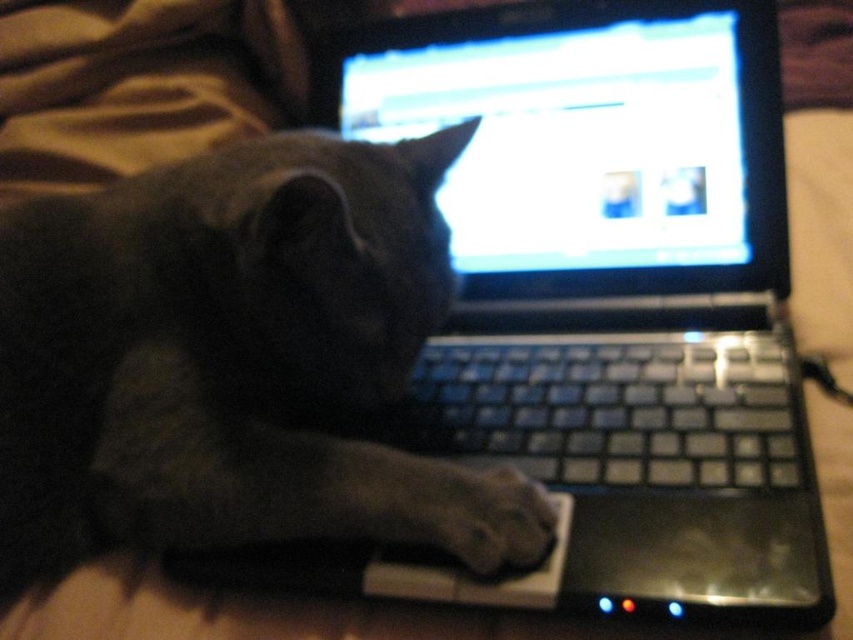
Locate an element on the screen. dark gray fur cat at center is located at coordinates (x=234, y=358).

Between dark gray fur cat at center and gray fur paw at lower center, which one is positioned higher?

dark gray fur cat at center is above.

Measure the distance between dark gray fur cat at center and camera.

dark gray fur cat at center and camera are 19.72 inches apart from each other.

The width and height of the screenshot is (853, 640). I want to click on dark gray fur cat at center, so click(x=234, y=358).

Does black plastic keyboard at center appear over gray fur paw at lower center?

Correct, black plastic keyboard at center is located above gray fur paw at lower center.

Between point (577, 381) and point (491, 538), which one is positioned behind?

The point (577, 381) is more distant.

Find the location of a particular element. black plastic keyboard at center is located at coordinates (616, 406).

Is black plastic laptop at center smaller than gray fur paw at lower center?

No.

At what (x,y) coordinates should I click in order to perform the action: click on black plastic laptop at center. Please return your answer as a coordinate pair (x, y). Looking at the image, I should click on (614, 289).